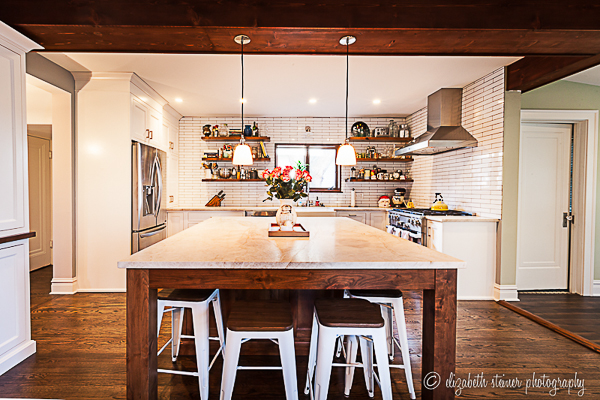
Identify the location of cabinet handle. (147, 134), (153, 134), (169, 146), (173, 147), (169, 201), (173, 199), (427, 233), (352, 216).